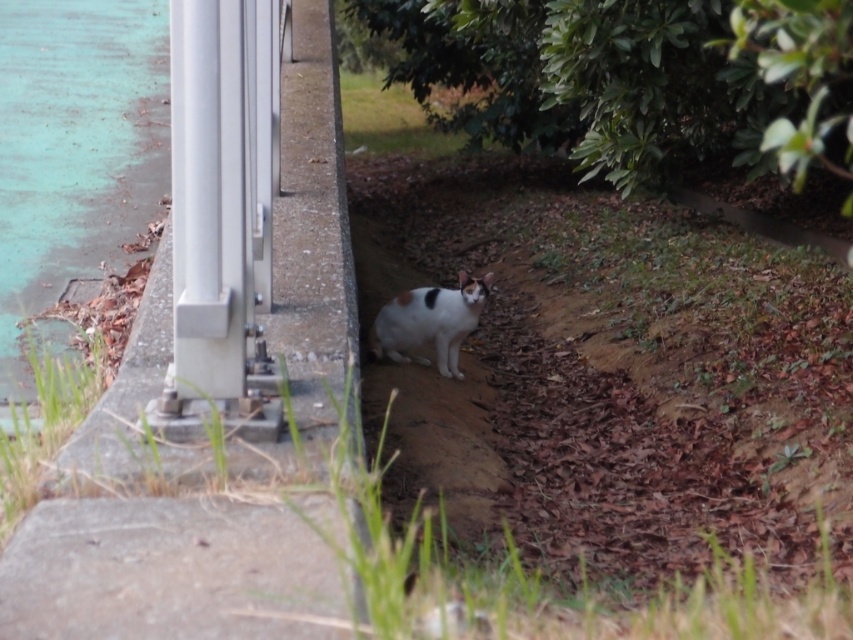
Can you confirm if brushed metal ledge at lower left is shorter than silver metallic rail at left?

Yes, brushed metal ledge at lower left is shorter than silver metallic rail at left.

Is brushed metal ledge at lower left smaller than silver metallic rail at left?

Correct, brushed metal ledge at lower left occupies less space than silver metallic rail at left.

Image resolution: width=853 pixels, height=640 pixels. What are the coordinates of `brushed metal ledge at lower left` in the screenshot? It's located at (241, 269).

Where is `brushed metal ledge at lower left`? brushed metal ledge at lower left is located at coordinates pyautogui.click(x=241, y=269).

The height and width of the screenshot is (640, 853). Identify the location of brushed metal ledge at lower left. (241, 269).

What do you see at coordinates (219, 220) in the screenshot?
I see `silver metallic rail at left` at bounding box center [219, 220].

Does point (242, 216) come closer to viewer compared to point (485, 292)?

That is True.

Find the location of `silver metallic rail at left`. silver metallic rail at left is located at coordinates (219, 220).